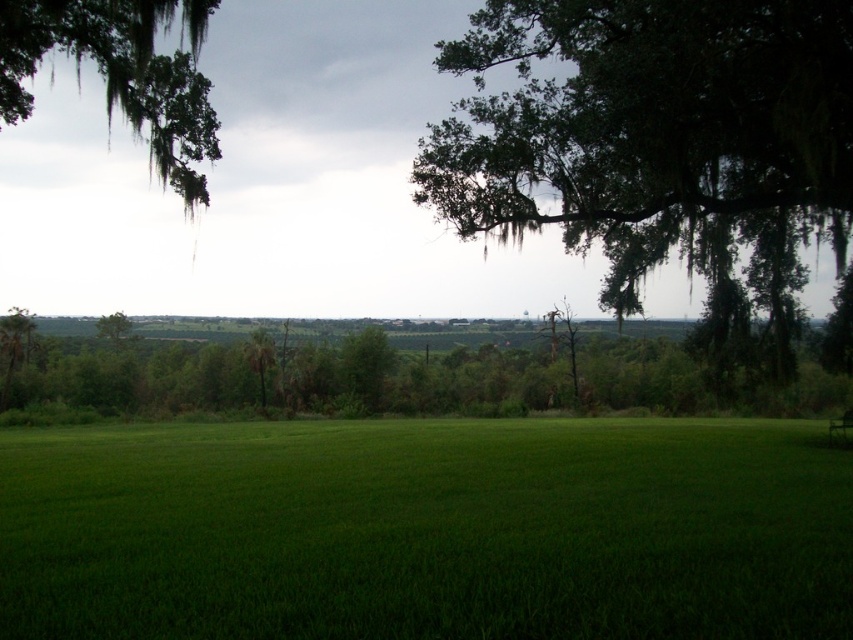
You are planning to set up a picnic blanket in the green grass at center. Considering the space available, will the green leafy tree at upper right provide enough shade to cover the entire picnic blanket? Please explain your reasoning based on the scene description.

The green grass at center has a larger width than the green leafy tree at upper right. Since the grass area is wider, the tree might not provide enough shade to cover the entire picnic blanket placed there.

You are planning to plant a new tree in the center of the field. The new tree will grow to be as wide as the green leafy tree at upper right. Based on the scene, will the space currently occupied by the green leafy tree at center be sufficient for the new tree?

The green leafy tree at upper right is wider than the green leafy tree at center. Therefore, the space currently occupied by the green leafy tree at center may not be sufficient for the new tree, as it is narrower than the width the new tree will reach.